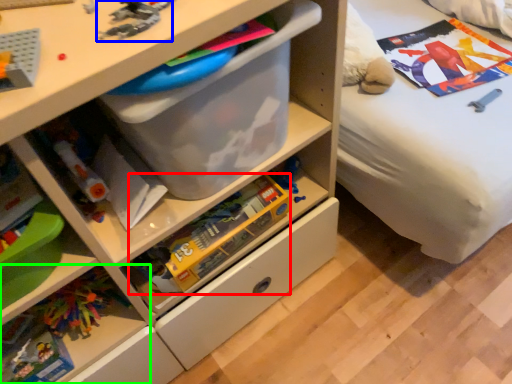
Question: Which is farther away from toy (highlighted by a red box)? toy (highlighted by a blue box) or shelf (highlighted by a green box)?

Choices:
 (A) toy
 (B) shelf

Answer: (A)